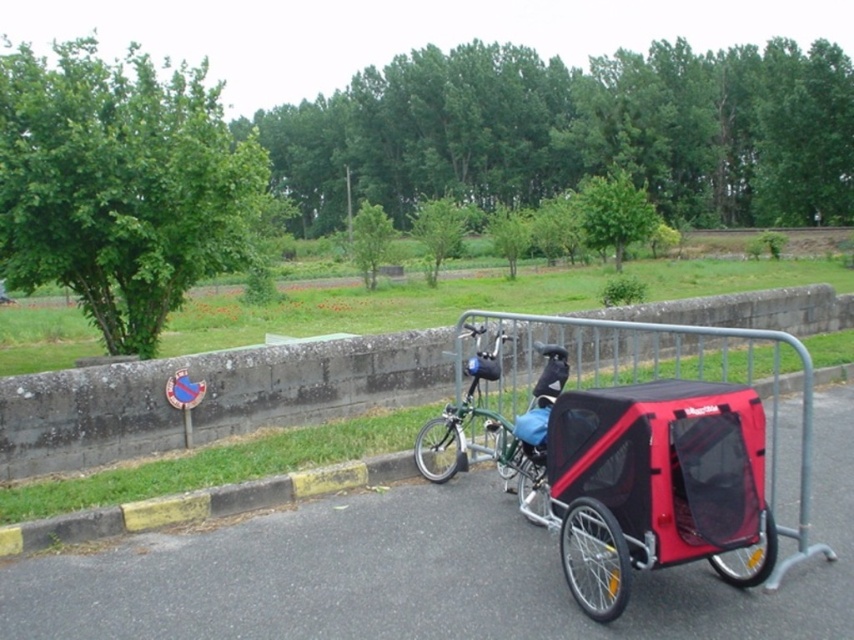
Question: Is red plastic trailer at center wider than green matte bicycle at center?

Choices:
 (A) yes
 (B) no

Answer: (A)

Question: Is red plastic trailer at center thinner than red mesh baby carriage at right?

Choices:
 (A) yes
 (B) no

Answer: (B)

Question: Which point is closer to the camera?

Choices:
 (A) (477, 381)
 (B) (619, 353)
 (C) (378, 356)

Answer: (A)

Question: From the image, what is the correct spatial relationship of metallic gray barrier at center in relation to red mesh baby carriage at right?

Choices:
 (A) left
 (B) right

Answer: (B)

Question: Among these points, which one is nearest to the camera?

Choices:
 (A) (120, 410)
 (B) (744, 518)
 (C) (428, 440)

Answer: (B)

Question: Among these points, which one is nearest to the camera?

Choices:
 (A) (513, 452)
 (B) (133, 417)
 (C) (624, 484)
 (D) (621, 340)

Answer: (C)